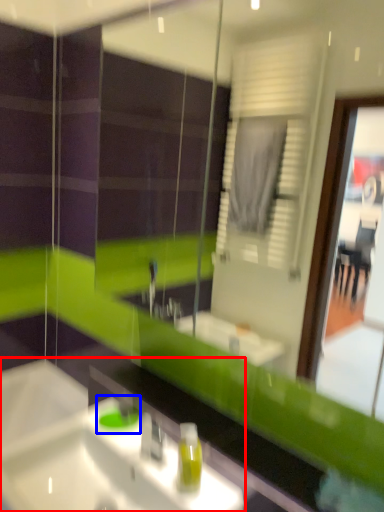
Question: Which of the following is the farthest to the observer, sink (highlighted by a red box) or teal (highlighted by a blue box)?

Choices:
 (A) sink
 (B) teal

Answer: (B)